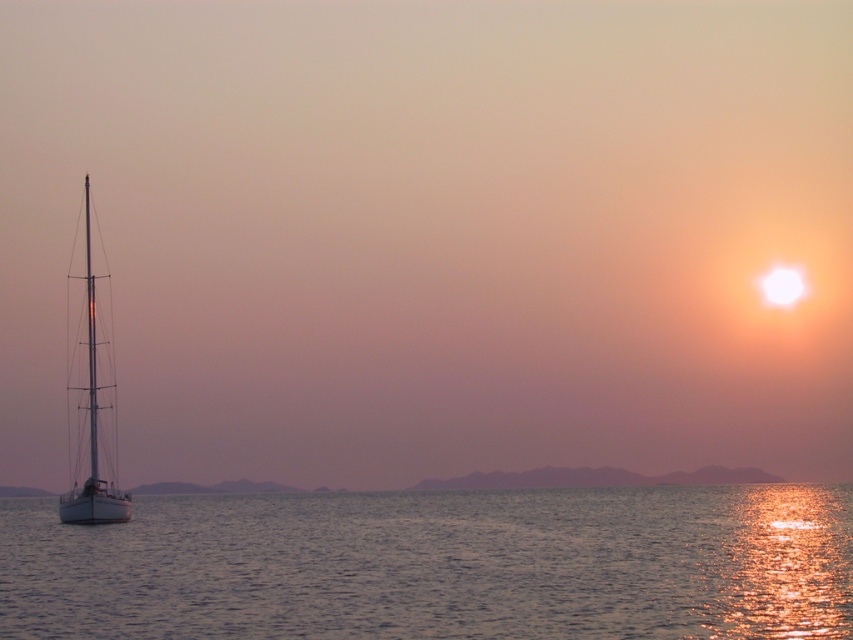
How much distance is there between glistening silver water at lower left and white glossy sailboat at left?

glistening silver water at lower left is 34.20 meters away from white glossy sailboat at left.

Does glistening silver water at lower left appear on the right side of white glossy sailboat at left?

Indeed, glistening silver water at lower left is positioned on the right side of white glossy sailboat at left.

In the scene shown: Who is more distant from viewer, (x=88, y=531) or (x=91, y=269)?

Positioned behind is point (x=91, y=269).

Identify the location of glistening silver water at lower left. The width and height of the screenshot is (853, 640). (438, 564).